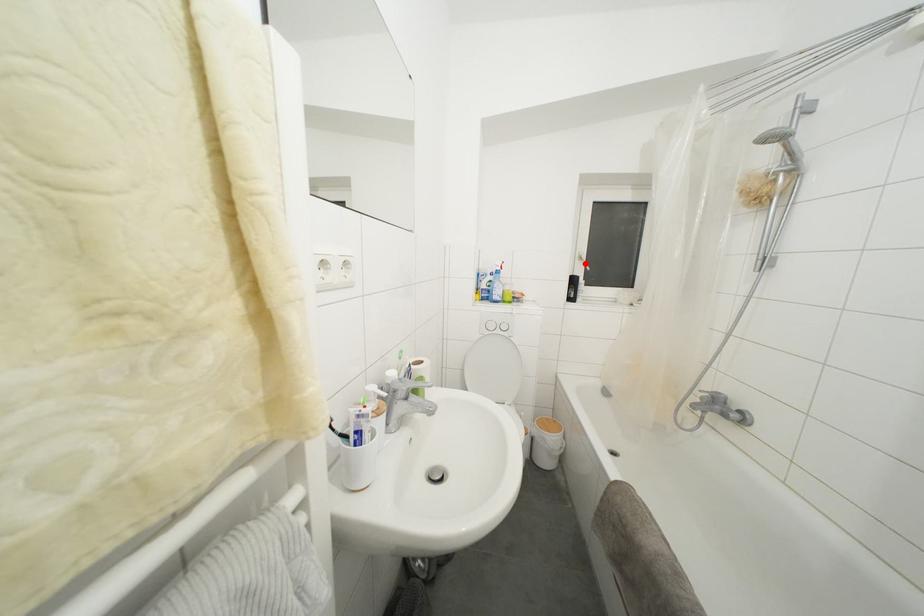
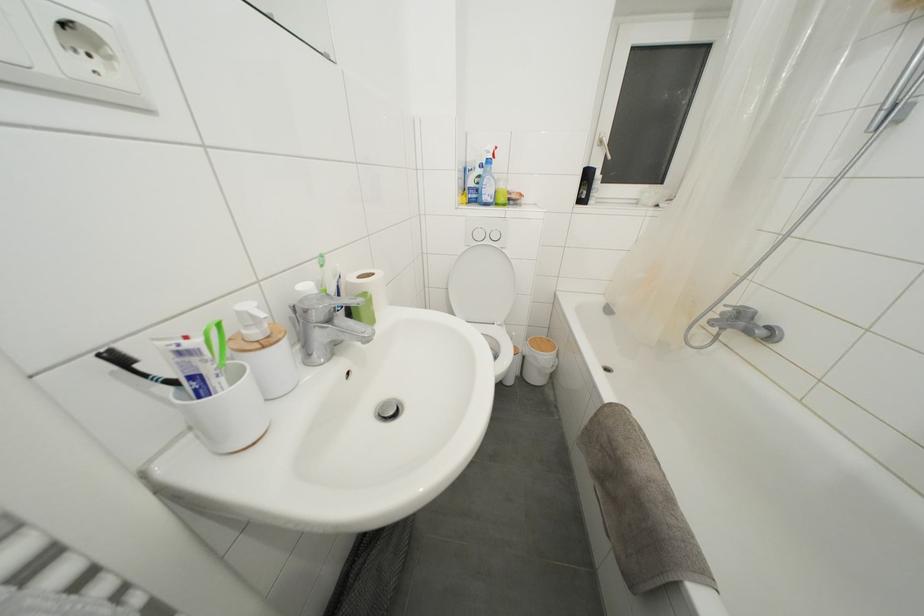
In the second image, find the point that corresponds to the highlighted location in the first image.

(604, 148)